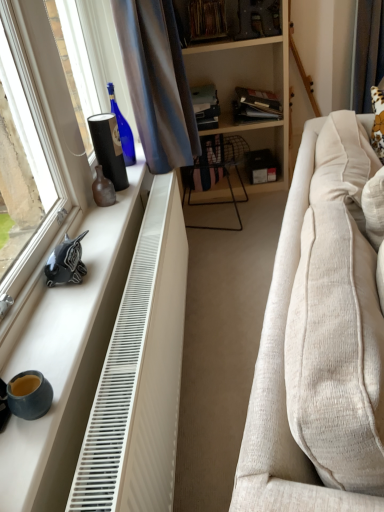
Question: Is beige fabric couch at right next to hardcover book at upper center, the 2th book positioned from the right, and touching it?

Choices:
 (A) yes
 (B) no

Answer: (B)

Question: From the image's perspective, would you say beige fabric couch at right is positioned over hardcover book at upper center, the second book positioned from the left?

Choices:
 (A) yes
 (B) no

Answer: (B)

Question: Is beige fabric couch at right oriented towards hardcover book at upper center, the second book positioned from the left?

Choices:
 (A) no
 (B) yes

Answer: (A)

Question: Does beige fabric couch at right appear on the left side of hardcover book at upper center, the second book positioned from the left?

Choices:
 (A) yes
 (B) no

Answer: (B)

Question: Does beige fabric couch at right have a greater width compared to hardcover book at upper center, the 2th book positioned from the right?

Choices:
 (A) yes
 (B) no

Answer: (A)

Question: Is beige fabric couch at right not near hardcover book at upper center, the second book positioned from the left?

Choices:
 (A) yes
 (B) no

Answer: (A)

Question: Does brown fabric curtain at upper right, which is the 1th curtain in right-to-left order, appear on the right side of satin blue curtain at upper left, which ranks as the 1th curtain in left-to-right order?

Choices:
 (A) yes
 (B) no

Answer: (A)

Question: Is brown fabric curtain at upper right, which is the second curtain from left to right, turned away from satin blue curtain at upper left, the second curtain viewed from the right?

Choices:
 (A) no
 (B) yes

Answer: (A)

Question: From a real-world perspective, is brown fabric curtain at upper right, the first curtain when ordered from back to front, physically below satin blue curtain at upper left, which is the first curtain in front-to-back order?

Choices:
 (A) no
 (B) yes

Answer: (B)

Question: Is brown fabric curtain at upper right, acting as the second curtain starting from the front, closer to camera compared to satin blue curtain at upper left, which ranks as the 1th curtain in left-to-right order?

Choices:
 (A) no
 (B) yes

Answer: (A)

Question: From the image's perspective, would you say brown fabric curtain at upper right, which is the 1th curtain in right-to-left order, is positioned over satin blue curtain at upper left, which is the first curtain in front-to-back order?

Choices:
 (A) no
 (B) yes

Answer: (B)

Question: Is satin blue curtain at upper left, which is the 2th curtain from back to front, located within brown fabric curtain at upper right, the first curtain when ordered from back to front?

Choices:
 (A) yes
 (B) no

Answer: (B)

Question: Does matte blue coffee cup at lower left have a smaller size compared to hardcover book at center, which appears as the 1th book when viewed from the left?

Choices:
 (A) no
 (B) yes

Answer: (B)